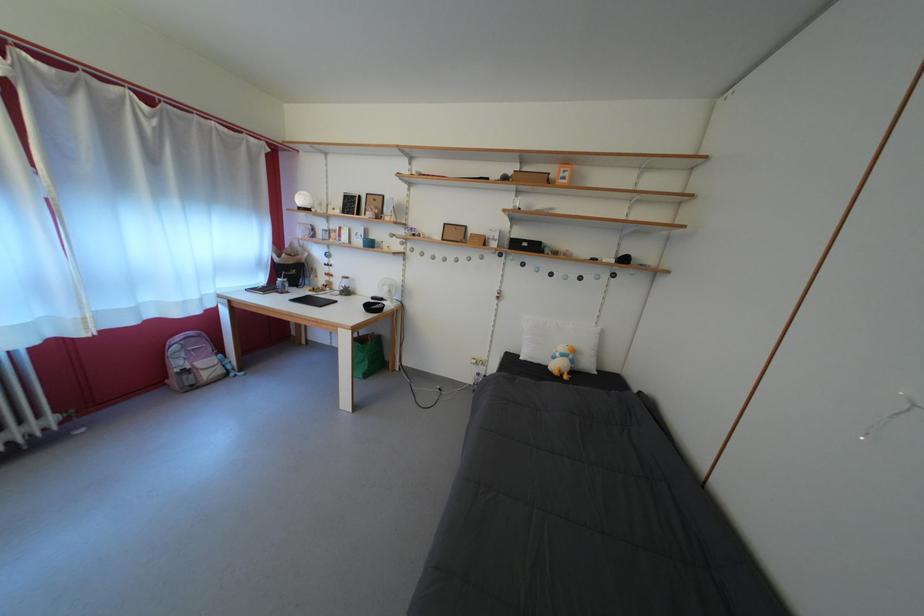
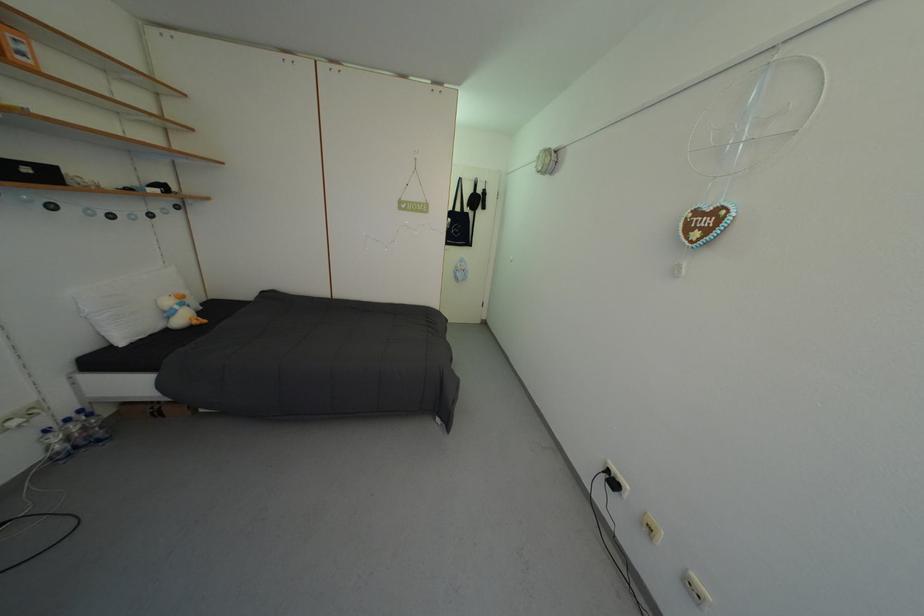
In the second image, find the point that corresponds to pixel 573 184 in the first image.

(30, 60)